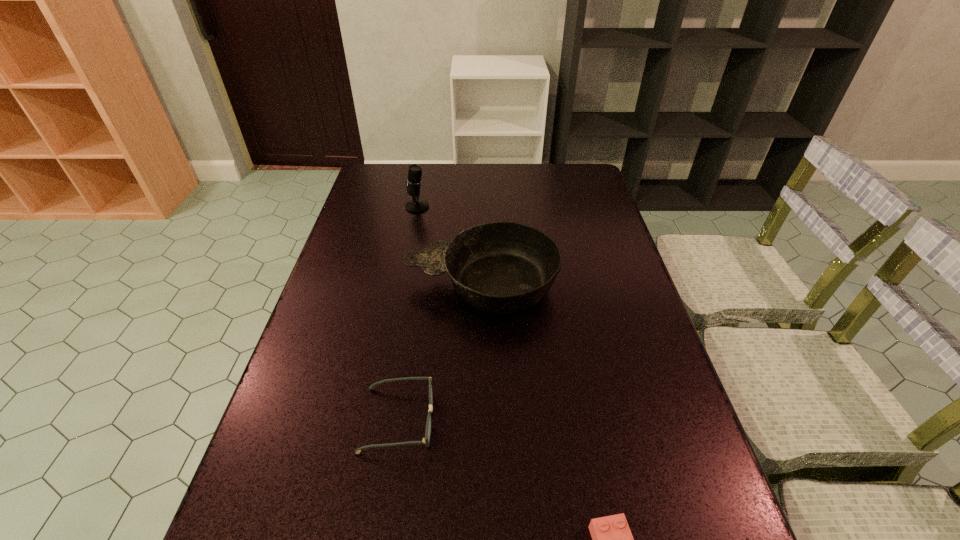
Identify the location of free space between the third tallest object and the microphone. (408, 313).

The image size is (960, 540). I want to click on empty space between the third shortest object and the spectacles, so click(x=440, y=352).

At what (x,y) coordinates should I click in order to perform the action: click on vacant space that is in between the third nearest object and the spectacles. Please return your answer as a coordinate pair (x, y). The image size is (960, 540). Looking at the image, I should click on (440, 352).

Identify the location of free space between the second shortest object and the third nearest object. The height and width of the screenshot is (540, 960). [440, 352].

Select which object is the closest to the third nearest object. Please provide its 2D coordinates. Your answer should be formatted as a tuple, i.e. [(x, y)], where the tuple contains the x and y coordinates of a point satisfying the conditions above.

[(426, 440)]

You are a GUI agent. You are given a task and a screenshot of the screen. Output one action in this format:
    pyautogui.click(x=<x>, y=<y>)
    Task: Click on the object that ranks as the third closest to the second farthest object
    The image size is (960, 540).
    Given the screenshot: What is the action you would take?
    pyautogui.click(x=612, y=539)